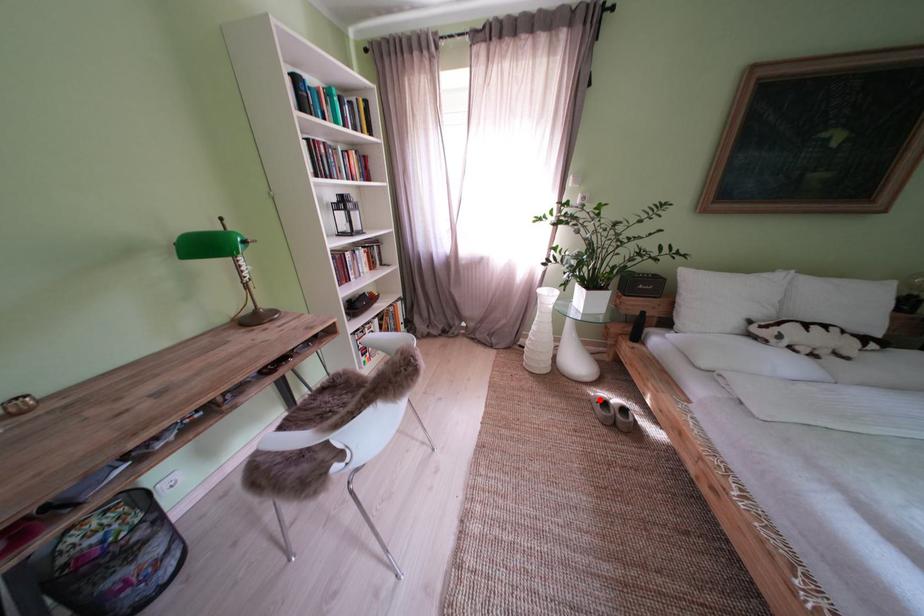
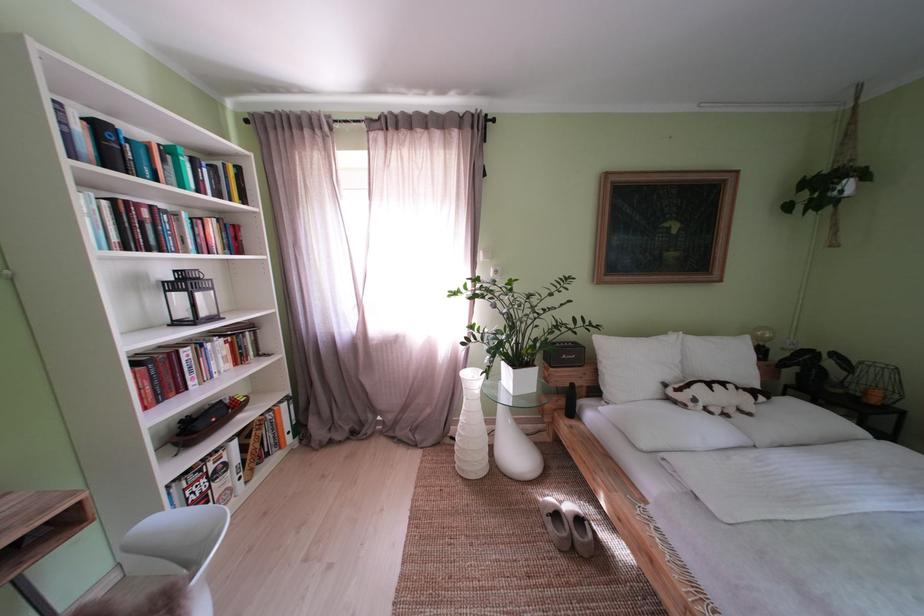
In the second image, find the point that corresponds to the highlighted location in the first image.

(546, 506)